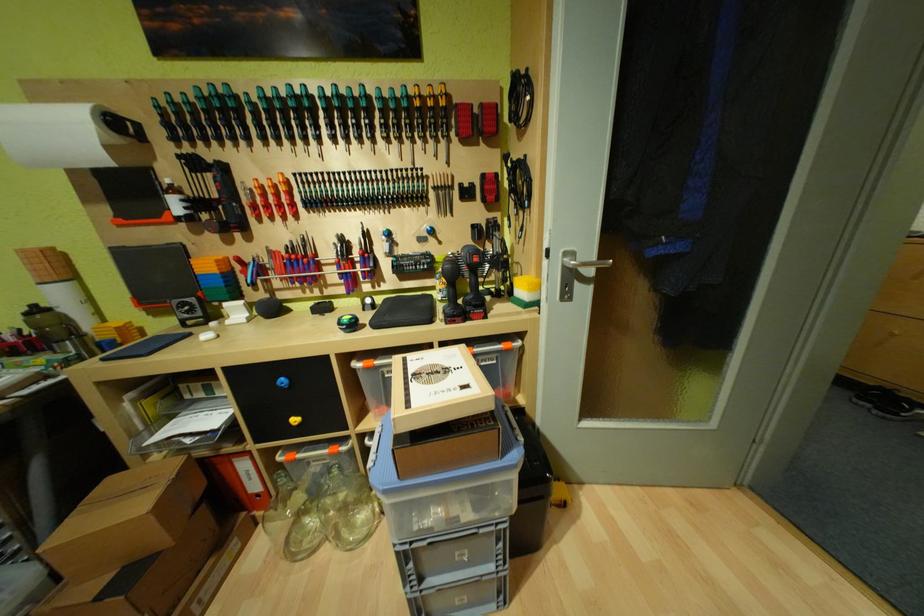
What are the coordinates of `white earbud case` in the screenshot? It's located at (404, 312).